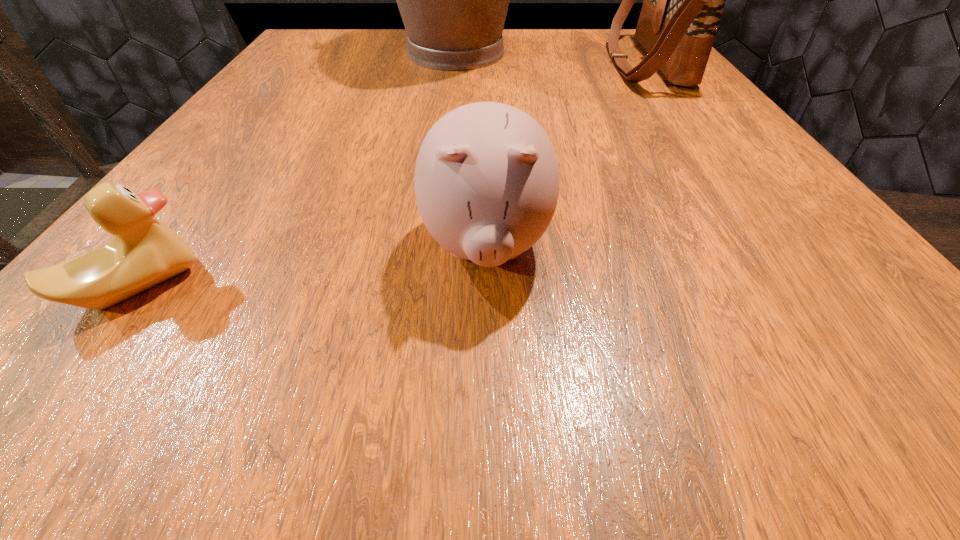
Locate an element on the screen. Image resolution: width=960 pixels, height=540 pixels. the tallest object is located at coordinates (453, 0).

The height and width of the screenshot is (540, 960). What are the coordinates of `the rightmost object` in the screenshot? It's located at tap(683, 3).

At what (x,y) coordinates should I click in order to perform the action: click on shoulder bag. Please return your answer as a coordinate pair (x, y). The width and height of the screenshot is (960, 540). Looking at the image, I should click on (683, 3).

In order to click on the second shortest object in this screenshot , I will do `click(486, 181)`.

Where is `the shortest object`? the shortest object is located at coordinates (144, 252).

In order to click on duck in this screenshot , I will do `click(144, 252)`.

Find the location of a particular element. Image resolution: width=960 pixels, height=540 pixels. free space located on the left of the tallest object is located at coordinates (301, 53).

At what (x,y) coordinates should I click in order to perform the action: click on vacant space situated 0.210m on the front-facing side of the shoulder bag. Please return your answer as a coordinate pair (x, y). The height and width of the screenshot is (540, 960). Looking at the image, I should click on (512, 63).

Locate an element on the screen. The image size is (960, 540). vacant space located on the front-facing side of the shoulder bag is located at coordinates (512, 63).

This screenshot has height=540, width=960. What are the coordinates of `free space located on the front-facing side of the shoulder bag` in the screenshot? It's located at (468, 63).